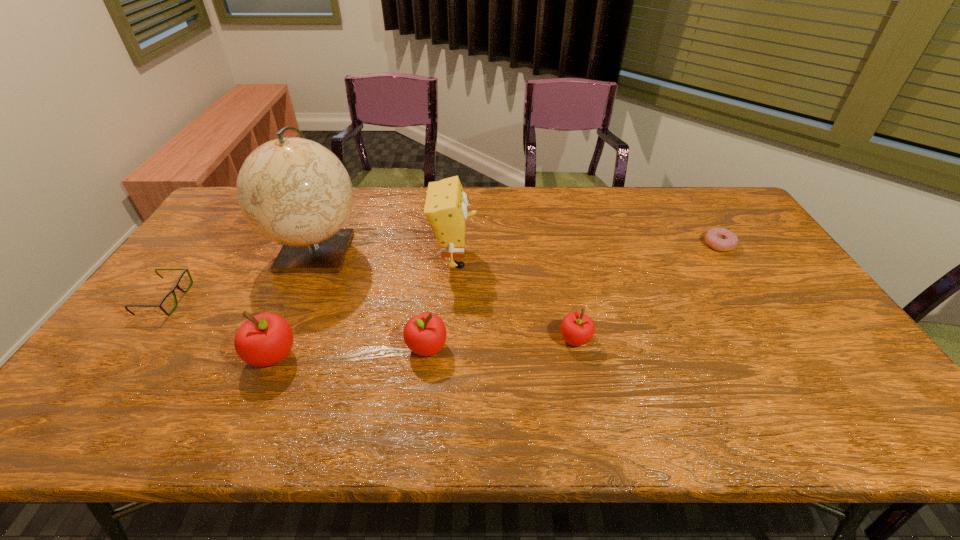
You are a GUI agent. You are given a task and a screenshot of the screen. Output one action in this format:
    pyautogui.click(x=<x>, y=<y>)
    Task: Click on the object present at the left edge
    
    Given the screenshot: What is the action you would take?
    pyautogui.click(x=176, y=285)

The width and height of the screenshot is (960, 540). In order to click on object at the right edge in this screenshot , I will do `click(720, 239)`.

Locate an element on the screen. vacant space at the far edge of the desktop is located at coordinates (621, 197).

Image resolution: width=960 pixels, height=540 pixels. I want to click on vacant region at the near edge of the desktop, so click(326, 373).

Identify the location of vacant space at the right edge. This screenshot has width=960, height=540. (742, 238).

This screenshot has height=540, width=960. In order to click on vacant region at the far left corner of the desktop in this screenshot , I will do click(225, 217).

You are a GUI agent. You are given a task and a screenshot of the screen. Output one action in this format:
    pyautogui.click(x=<x>, y=<y>)
    Task: Click on the free point between the doughnut and the fifth tallest object
    Image resolution: width=960 pixels, height=540 pixels.
    Given the screenshot: What is the action you would take?
    pyautogui.click(x=647, y=292)

This screenshot has width=960, height=540. Find the location of `free space between the second shortest apple and the tallest object`. free space between the second shortest apple and the tallest object is located at coordinates (372, 299).

This screenshot has width=960, height=540. Find the location of `free space between the second apple from right to left and the sixth tallest object`. free space between the second apple from right to left and the sixth tallest object is located at coordinates (296, 323).

Where is `vacant area that lies between the tallest apple and the rightmost object`? Image resolution: width=960 pixels, height=540 pixels. vacant area that lies between the tallest apple and the rightmost object is located at coordinates (496, 300).